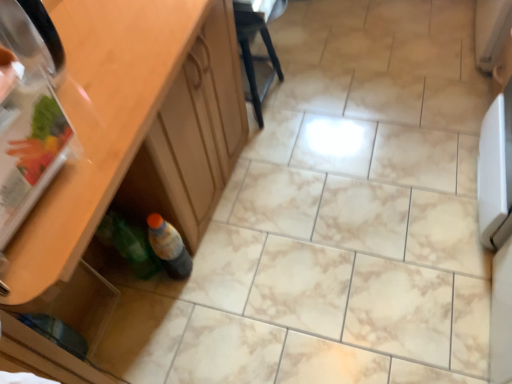
Question: Is green plastic bottle at lower left, which ranks as the first bottle in left-to-right order, at the right side of black plastic chair at center?

Choices:
 (A) yes
 (B) no

Answer: (B)

Question: Can you confirm if green plastic bottle at lower left, which ranks as the first bottle in left-to-right order, is bigger than black plastic chair at center?

Choices:
 (A) yes
 (B) no

Answer: (B)

Question: Is green plastic bottle at lower left, acting as the 2th bottle starting from the right, taller than black plastic chair at center?

Choices:
 (A) yes
 (B) no

Answer: (B)

Question: From a real-world perspective, is green plastic bottle at lower left, which ranks as the first bottle in left-to-right order, physically above black plastic chair at center?

Choices:
 (A) yes
 (B) no

Answer: (B)

Question: Is green plastic bottle at lower left, acting as the 2th bottle starting from the right, aimed at black plastic chair at center?

Choices:
 (A) no
 (B) yes

Answer: (A)

Question: Looking at the image, does translucent plastic bottle at lower left, arranged as the first bottle when viewed from the right, seem bigger or smaller compared to transparent plastic drawer at lower left?

Choices:
 (A) small
 (B) big

Answer: (A)

Question: From the image's perspective, is translucent plastic bottle at lower left, the second bottle viewed from the left, above or below transparent plastic drawer at lower left?

Choices:
 (A) below
 (B) above

Answer: (B)

Question: Is translucent plastic bottle at lower left, arranged as the first bottle when viewed from the right, wider or thinner than transparent plastic drawer at lower left?

Choices:
 (A) thin
 (B) wide

Answer: (A)

Question: In the image, is translucent plastic bottle at lower left, the second bottle viewed from the left, on the left side or the right side of transparent plastic drawer at lower left?

Choices:
 (A) left
 (B) right

Answer: (B)

Question: From a real-world perspective, is transparent plastic drawer at lower left physically located above or below wooden cabinet at lower left?

Choices:
 (A) below
 (B) above

Answer: (A)

Question: Is transparent plastic drawer at lower left wider or thinner than wooden cabinet at lower left?

Choices:
 (A) wide
 (B) thin

Answer: (B)

Question: Do you think transparent plastic drawer at lower left is within wooden cabinet at lower left, or outside of it?

Choices:
 (A) inside
 (B) outside

Answer: (A)

Question: Based on their positions, is transparent plastic drawer at lower left located to the left or right of wooden cabinet at lower left?

Choices:
 (A) right
 (B) left

Answer: (B)

Question: From a real-world perspective, is translucent plastic bottle at lower left, arranged as the first bottle when viewed from the right, positioned above or below green plastic bottle at lower left, which ranks as the first bottle in left-to-right order?

Choices:
 (A) above
 (B) below

Answer: (B)

Question: Does point [x=168, y=269] appear closer or farther from the camera than point [x=132, y=261]?

Choices:
 (A) farther
 (B) closer

Answer: (A)